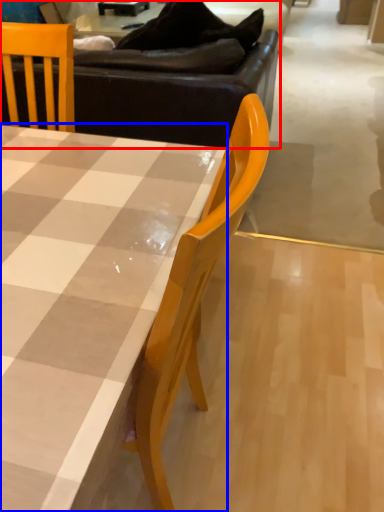
Question: Which of the following is the closest to the observer, studio couch (highlighted by a red box) or table (highlighted by a blue box)?

Choices:
 (A) studio couch
 (B) table

Answer: (B)